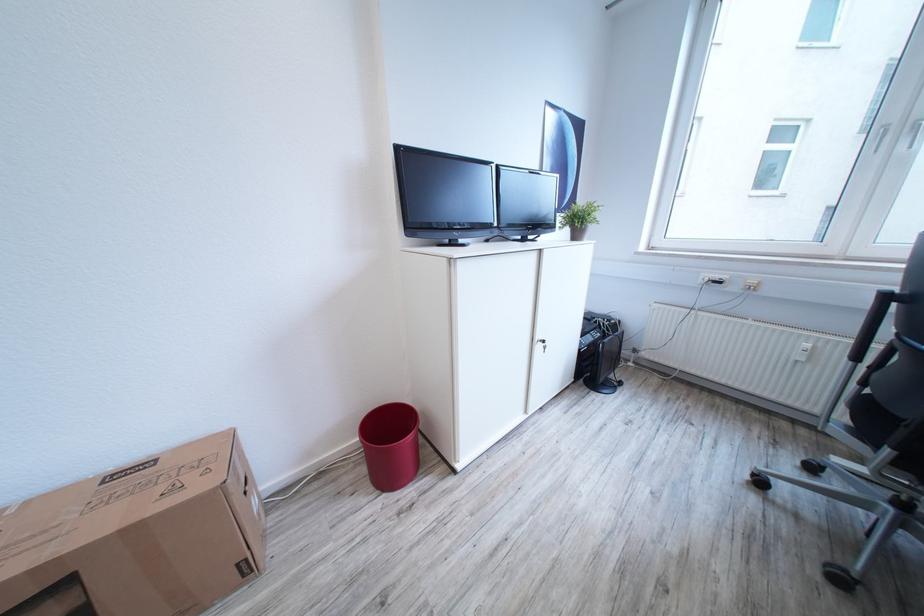
Find where to sit the chair sitting surface. Please return your answer as a coordinate pair (x, y).

(898, 394)